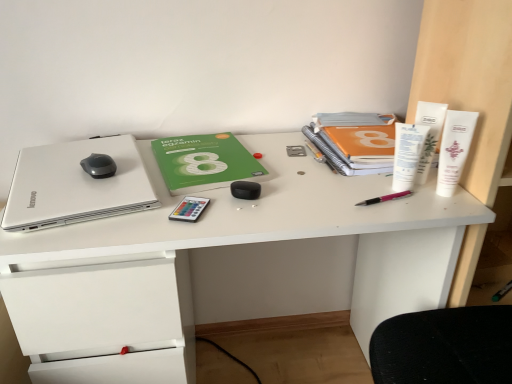
The image size is (512, 384). Identify the location of vacant area that lies in front of pink metallic pen at center-right, which is the second stationery in left-to-right order. (391, 216).